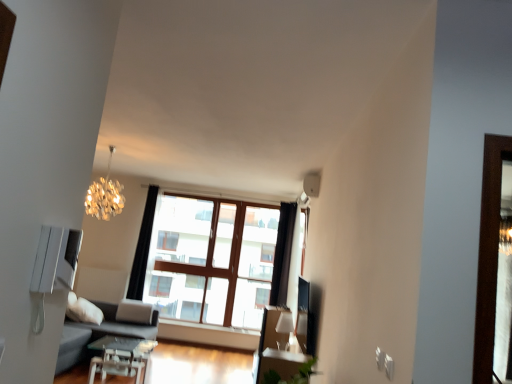
Question: Is white glossy lampshade at upper center, which ranks as the second lamp in top-to-bottom order, wider or thinner than dark gray fabric couch at lower left?

Choices:
 (A) thin
 (B) wide

Answer: (A)

Question: Is white glossy lampshade at upper center, the second lamp when ordered from left to right, inside or outside of dark gray fabric couch at lower left?

Choices:
 (A) inside
 (B) outside

Answer: (B)

Question: Estimate the real-world distances between objects in this image. Which object is closer to the shiny metallic chandelier at upper left, acting as the second lamp starting from the right?

Choices:
 (A) black fabric curtain at center
 (B) transparent glass table at center
 (C) white glossy lampshade at upper center, the 1th lamp when ordered from bottom to top
 (D) clear glass window at center
 (E) dark gray fabric couch at lower left

Answer: (A)

Question: Estimate the real-world distances between objects in this image. Which object is closer to the white glossy lampshade at upper center, acting as the first lamp starting from the right?

Choices:
 (A) transparent glass table at center
 (B) black fabric curtain at center
 (C) clear glass window at center
 (D) dark gray fabric couch at lower left
 (E) shiny metallic chandelier at upper left, which ranks as the first lamp in top-to-bottom order

Answer: (C)